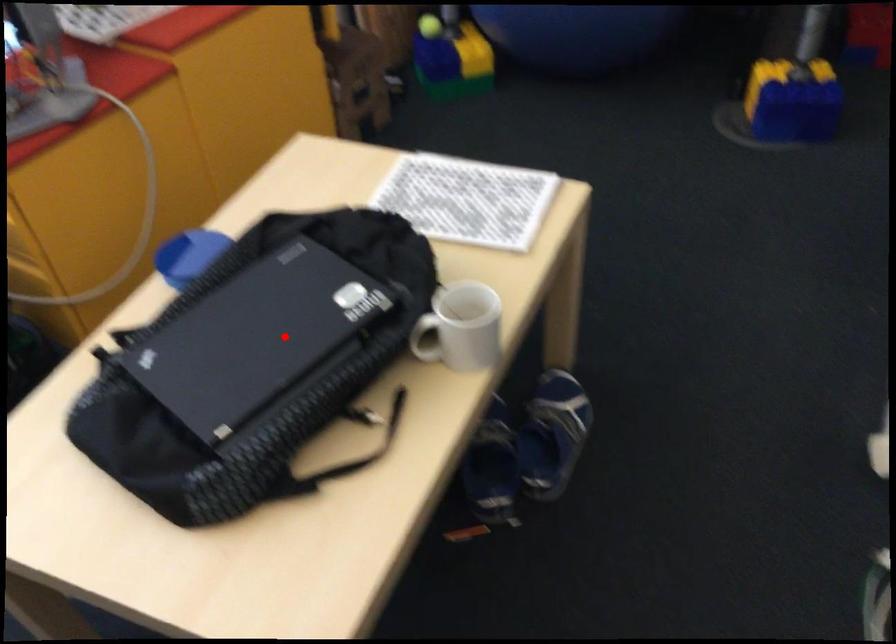
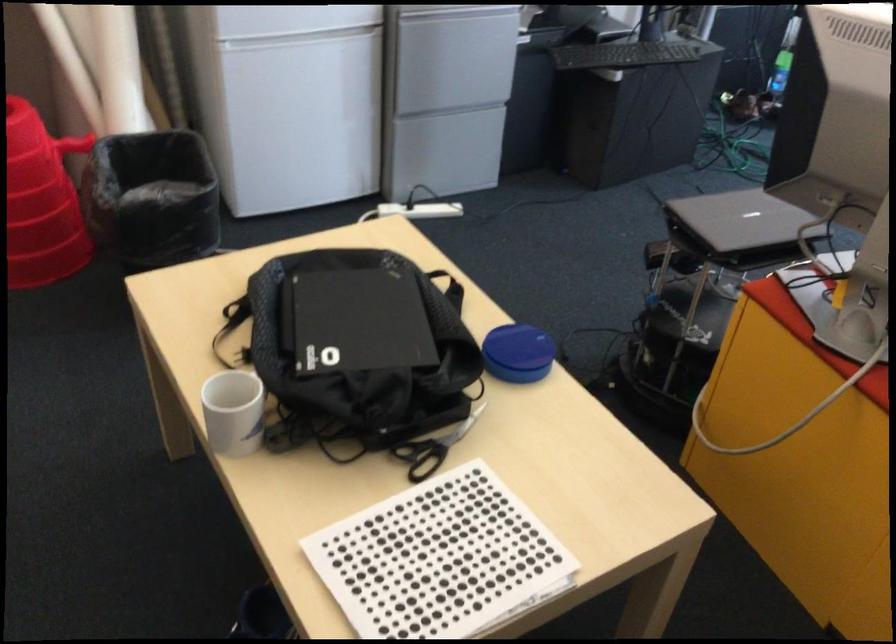
In the second image, find the point that corresponds to the highlighted location in the first image.

(355, 321)